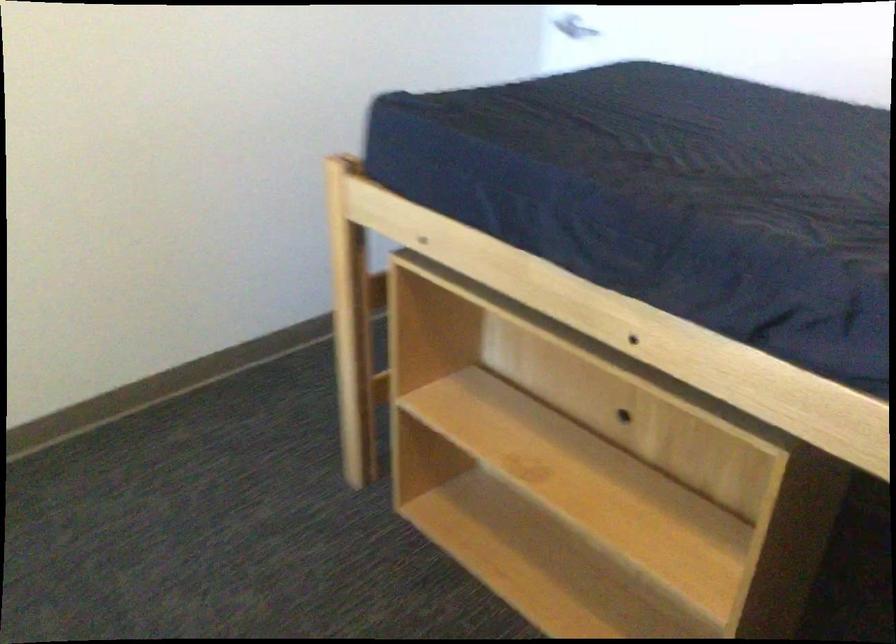
Where is `wooden bed frame rail`? This screenshot has height=644, width=896. wooden bed frame rail is located at coordinates (392, 214).